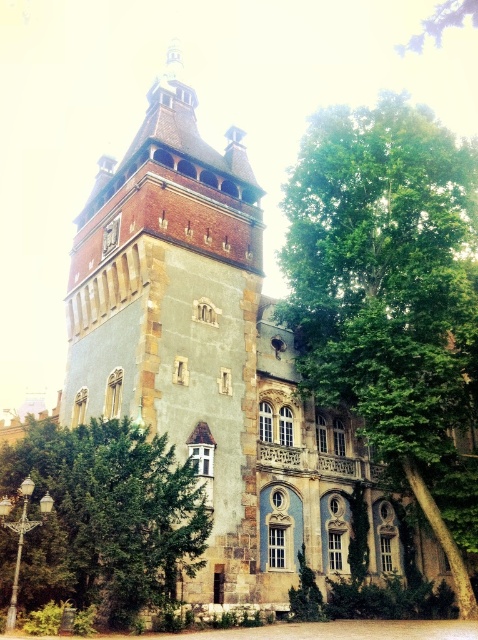
Who is positioned more to the right, green leafy tree at right or green leafy tree at lower left?

green leafy tree at right is more to the right.

Is point (310, 147) positioned behind point (33, 528)?

That is True.

At what (x,y) coordinates should I click in order to perform the action: click on green leafy tree at right. Please return your answer as a coordinate pair (x, y). This screenshot has width=478, height=640. Looking at the image, I should click on (391, 296).